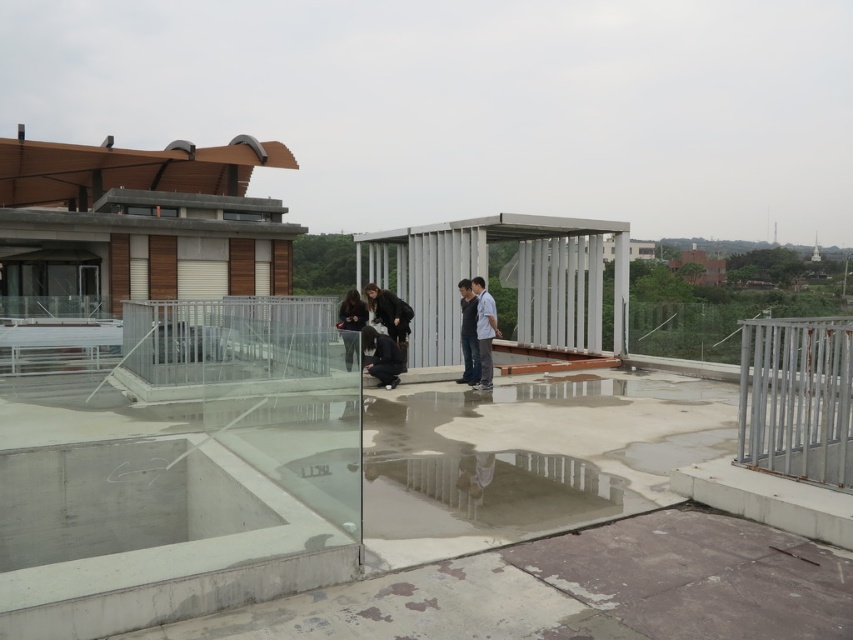
You are standing on the rooftop and want to take a photo of the silver metallic rail at right and the matte black jacket at center. Which object should you focus on first if you want to capture both in the same frame without moving the camera?

The silver metallic rail at right is much taller than the matte black jacket at center, so you should focus on the silver metallic rail at right first to ensure it fits within the frame.

You are a photographer trying to capture a closeup of both the dark gray fabric shirt at center and the matte black jacket at center. Since you want to focus on the details of each, which one would you need to zoom in more on to ensure it fills the frame appropriately?

The dark gray fabric shirt at center occupies less space than the matte black jacket at center, so you would need to zoom in more on the dark gray fabric shirt at center to ensure it fills the frame appropriately.

You are standing on the rooftop and want to walk from point A to point B. Point A is at coordinate point [403,301] and point B is at coordinate point [346,365]. Which point is closer to you when you start walking?

Point A at coordinate point [403,301] is closer to you because it is further to the viewer than point B at coordinate point [346,365], meaning it is physically nearer in the scene.